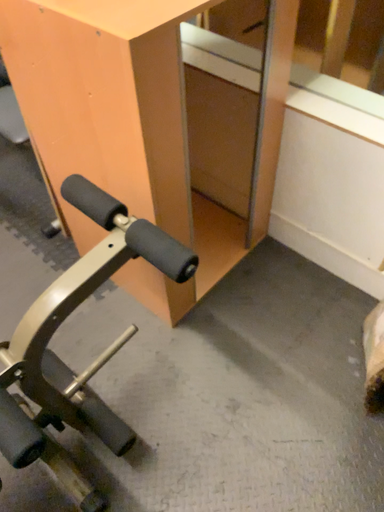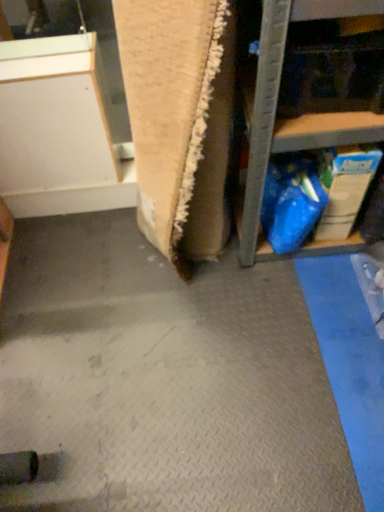
Question: Which way did the camera rotate in the video?

Choices:
 (A) rotated upward
 (B) rotated downward

Answer: (A)